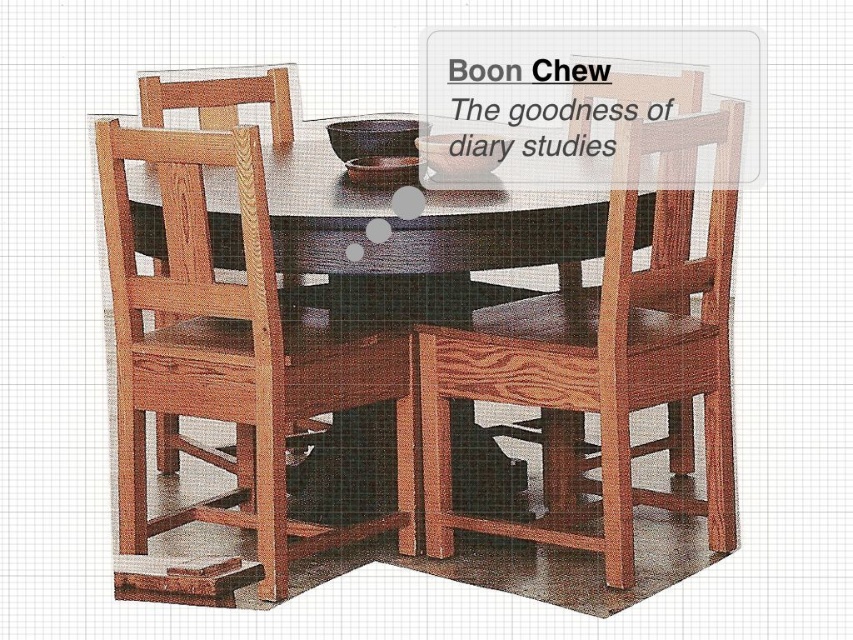
Question: Which point appears closest to the camera in this image?

Choices:
 (A) (370, 532)
 (B) (726, 108)

Answer: (B)

Question: Can you confirm if wooden chair at center is thinner than wooden table at center?

Choices:
 (A) no
 (B) yes

Answer: (B)

Question: Does natural wood chair at lower left appear under natural wood chair at center?

Choices:
 (A) no
 (B) yes

Answer: (B)

Question: Does wooden chair at center have a smaller size compared to natural wood chair at center?

Choices:
 (A) yes
 (B) no

Answer: (B)

Question: Based on their relative distances, which object is nearer to the wooden table at center?

Choices:
 (A) natural wood chair at center
 (B) wooden chair at center
 (C) natural wood chair at lower left

Answer: (C)

Question: Which of the following is the farthest from the observer?

Choices:
 (A) (247, 292)
 (B) (605, 321)
 (C) (148, 234)

Answer: (C)